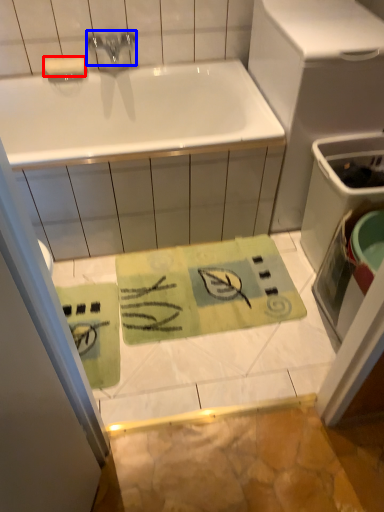
Question: Which object appears closest to the camera in this image, soap (highlighted by a red box) or tap (highlighted by a blue box)?

Choices:
 (A) soap
 (B) tap

Answer: (B)